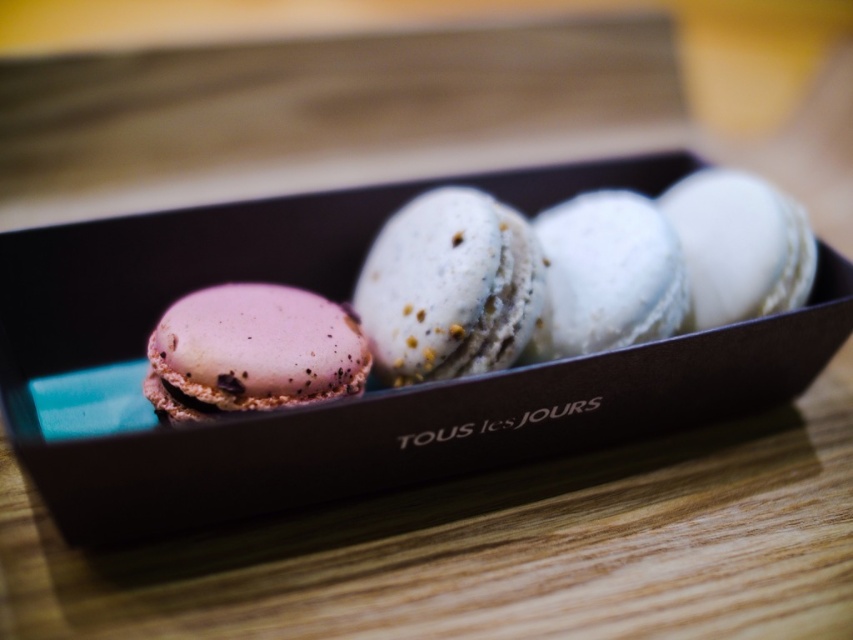
Can you confirm if matte white macaron at center is taller than pink matte macaron at left?

Yes, matte white macaron at center is taller than pink matte macaron at left.

Is matte white macaron at center below pink matte macaron at left?

No.

Is point (415, 310) less distant than point (321, 348)?

That is False.

The image size is (853, 640). What are the coordinates of `matte white macaron at center` in the screenshot? It's located at (450, 288).

Between point (286, 241) and point (576, 282), which one is positioned in front?

Positioned in front is point (576, 282).

Which is below, matte black box at center or white textured macaron at center?

matte black box at center

Is point (608, 438) closer to camera compared to point (599, 333)?

No, (608, 438) is further to viewer.

Find the location of `matte black box at center`. matte black box at center is located at coordinates (367, 392).

The image size is (853, 640). What do you see at coordinates (606, 275) in the screenshot?
I see `white textured macaron at center` at bounding box center [606, 275].

Who is more distant from viewer, (579, 218) or (804, 220)?

The point (579, 218) is more distant.

Where is `white textured macaron at center`? The height and width of the screenshot is (640, 853). white textured macaron at center is located at coordinates (606, 275).